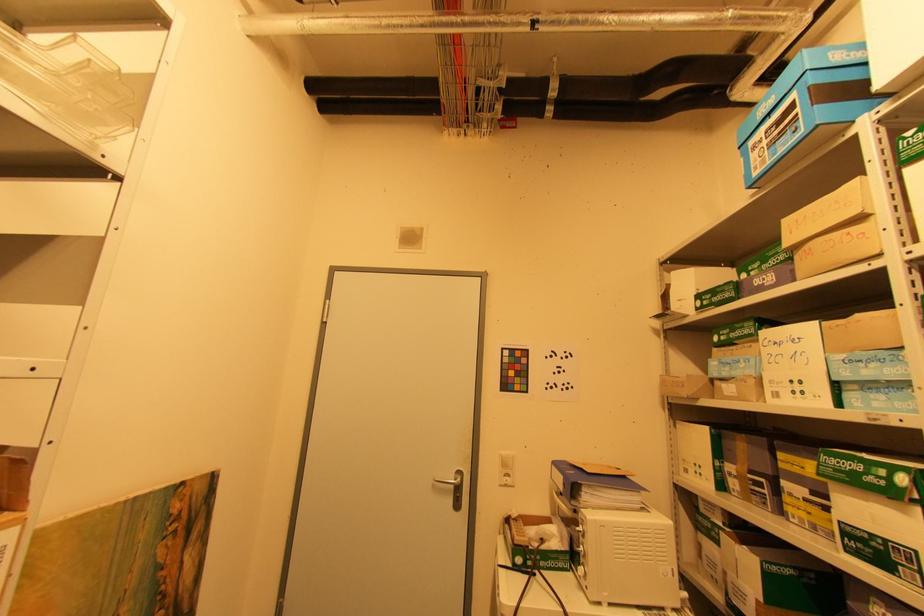
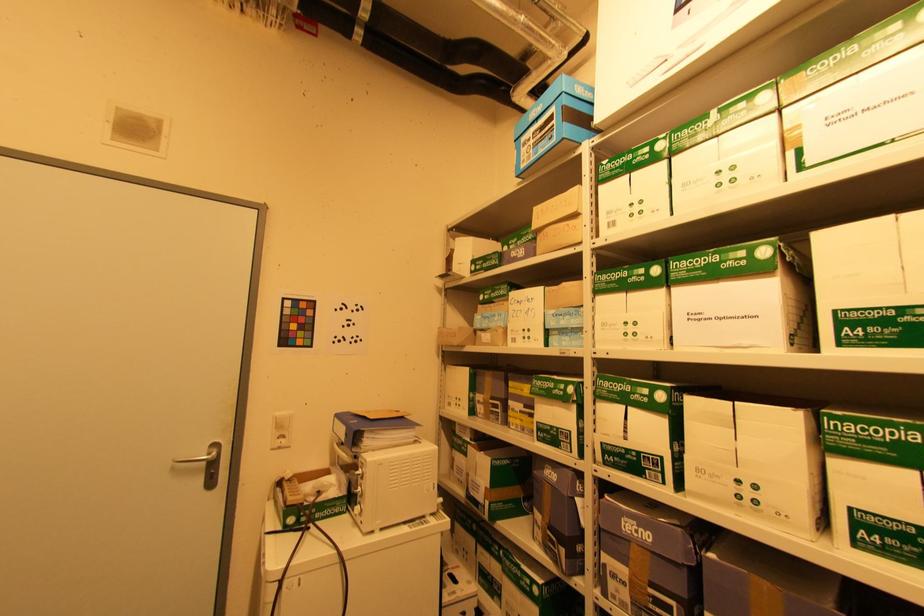
Question: The camera is either moving clockwise (left) or counter-clockwise (right) around the object. The first image is from the beginning of the video and the second image is from the end. Is the camera moving left or right when shooting the video?

Choices:
 (A) Left
 (B) Right

Answer: (A)